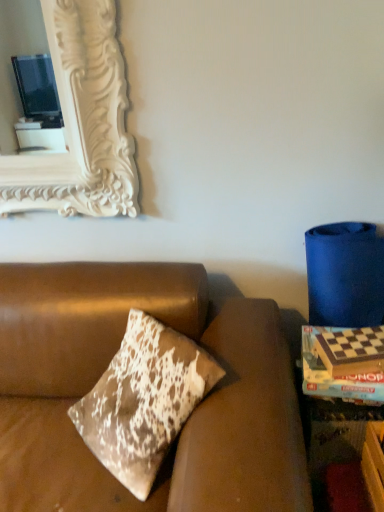
Question: In the image, is brown leather couch at center positioned in front of or behind wooden checkered game board at right?

Choices:
 (A) behind
 (B) front

Answer: (B)

Question: From a real-world perspective, is brown leather couch at center physically located above or below wooden checkered game board at right?

Choices:
 (A) above
 (B) below

Answer: (B)

Question: Do you think brown leather couch at center is within wooden checkered game board at right, or outside of it?

Choices:
 (A) inside
 (B) outside

Answer: (B)

Question: Is wooden checkered game board at right taller or shorter than brown leather couch at center?

Choices:
 (A) short
 (B) tall

Answer: (A)

Question: Is point (374, 377) closer or farther from the camera than point (193, 452)?

Choices:
 (A) farther
 (B) closer

Answer: (A)

Question: Would you say wooden checkered game board at right is inside or outside brown leather couch at center?

Choices:
 (A) inside
 (B) outside

Answer: (B)

Question: Visually, is wooden checkered game board at right positioned to the left or to the right of brown leather couch at center?

Choices:
 (A) right
 (B) left

Answer: (A)